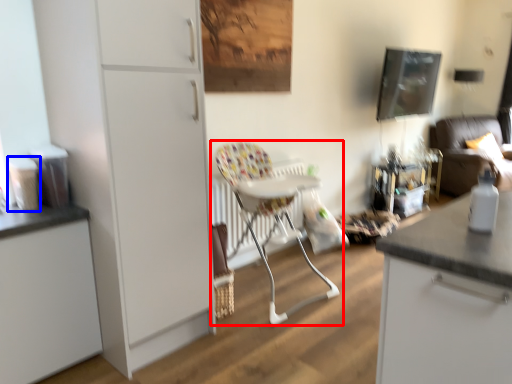
Question: Among these objects, which one is nearest to the camera, chair (highlighted by a red box) or appliance (highlighted by a blue box)?

Choices:
 (A) chair
 (B) appliance

Answer: (B)